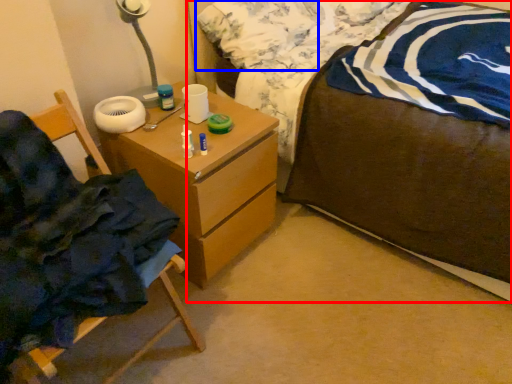
Question: Which of the following is the closest to the observer, bed (highlighted by a red box) or pillow (highlighted by a blue box)?

Choices:
 (A) bed
 (B) pillow

Answer: (A)